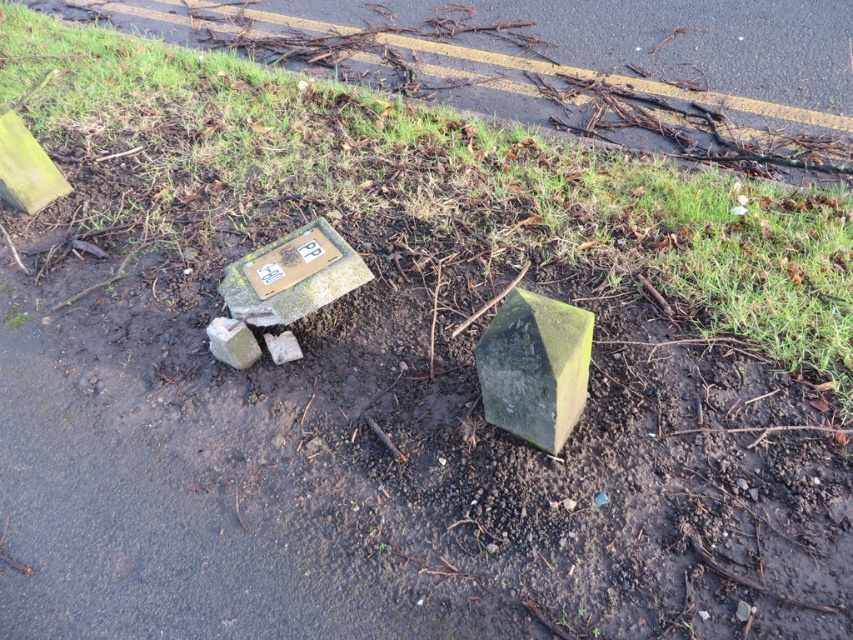
You are standing at the center of the image and want to place a small flag at the green grass at upper center. What are the coordinates where you should place the flag?

The coordinates for the green grass at upper center are 0.280 in the x direction and 0.523 in the y direction.

You are a gardener who wants to plant a row of flowers between the green grass at upper center and the green stone cube at center. Since the grass is wider than the stone cube, which side should you place the flowers to ensure they have enough space?

The green grass at upper center is wider than the green stone cube at center, so you should place the flowers on the side of the green grass at upper center to ensure they have enough space.

Looking at this image, you are standing at the edge of the road looking at the scene. You want to place a 10 feet long fence post between you and the green grass at upper center. Is the distance sufficient to accommodate the fence post?

The distance of green grass at upper center from viewer is 8.93 feet, which is less than the 10 feet required for the fence post. Therefore, the distance is insufficient to place the fence post between you and the green grass at upper center.